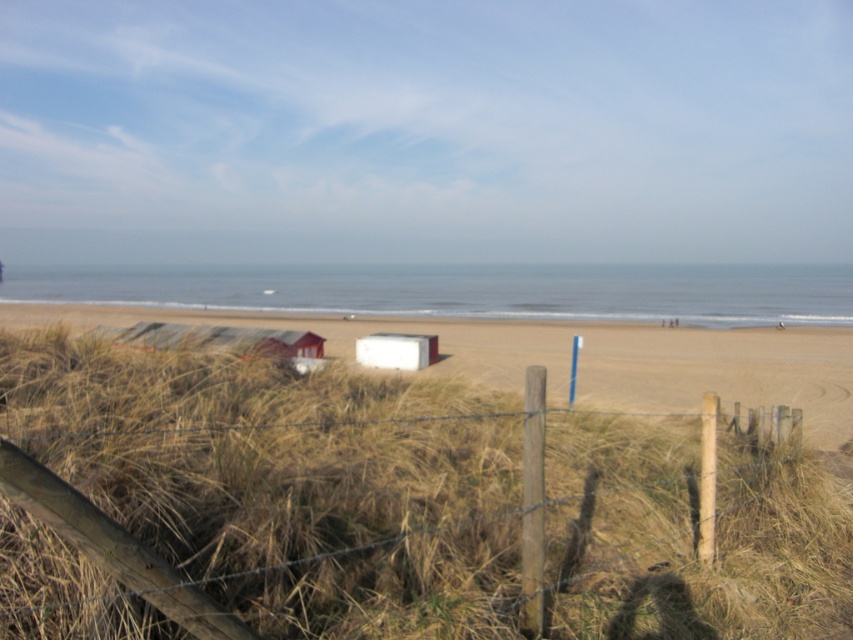
You are planning to build a new small cabin on the beach. The golden dry grass at center and the white matte beach hut at center are already present. Which of these two can you replace if you want to build your cabin in the center area?

The white matte beach hut at center can be replaced because it is smaller in size than the golden dry grass at center, making it easier to remove to make space for the new cabin.

You are standing at the wooden fence with barbed wire and want to walk to the white matte beach hut at center. Which direction should you go from the beige sandy beach at center to reach the hut?

You should walk to the right from the beige sandy beach at center since it is to the left of the white matte beach hut at center.

You are standing at the wooden fence with barbed wire and want to walk to the blue post near the fence. Which direction should you go relative to the beige sandy beach at center?

Since the beige sandy beach at center is located at point (578, 356), you should walk towards the beige sandy beach at center to reach the blue post near the fence.